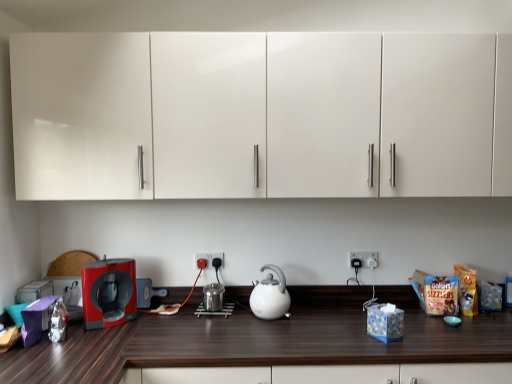
Question: From the image's perspective, is red glossy coffee machine at left located above or below dark wood countertop at lower center?

Choices:
 (A) above
 (B) below

Answer: (A)

Question: Considering their positions, is red glossy coffee machine at left located in front of or behind dark wood countertop at lower center?

Choices:
 (A) behind
 (B) front

Answer: (A)

Question: Which of these objects is positioned closest to the red glossy coffee machine at left?

Choices:
 (A) white glossy kettle at center
 (B) white plastic electric outlet at center, acting as the second electric outlet starting from the left
 (C) black plastic electric outlet at center, the first electric outlet viewed from the left
 (D) white glossy cabinets at upper center
 (E) dark wood countertop at lower center

Answer: (E)

Question: Estimate the real-world distances between objects in this image. Which object is farther from the red glossy coffee machine at left?

Choices:
 (A) dark wood countertop at lower center
 (B) white glossy cabinets at upper center
 (C) white glossy kettle at center
 (D) black plastic electric outlet at center, marked as the second electric outlet in a right-to-left arrangement
 (E) white plastic electric outlet at center, marked as the 1th electric outlet in a right-to-left arrangement

Answer: (E)